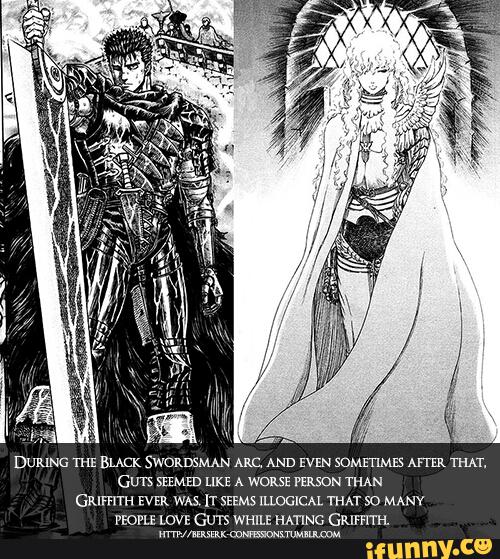
Identify the location of window. (404, 36).